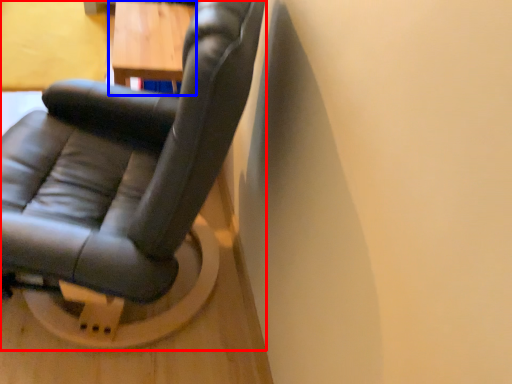
Question: Which of the following is the farthest to the observer, chair (highlighted by a red box) or table (highlighted by a blue box)?

Choices:
 (A) chair
 (B) table

Answer: (B)